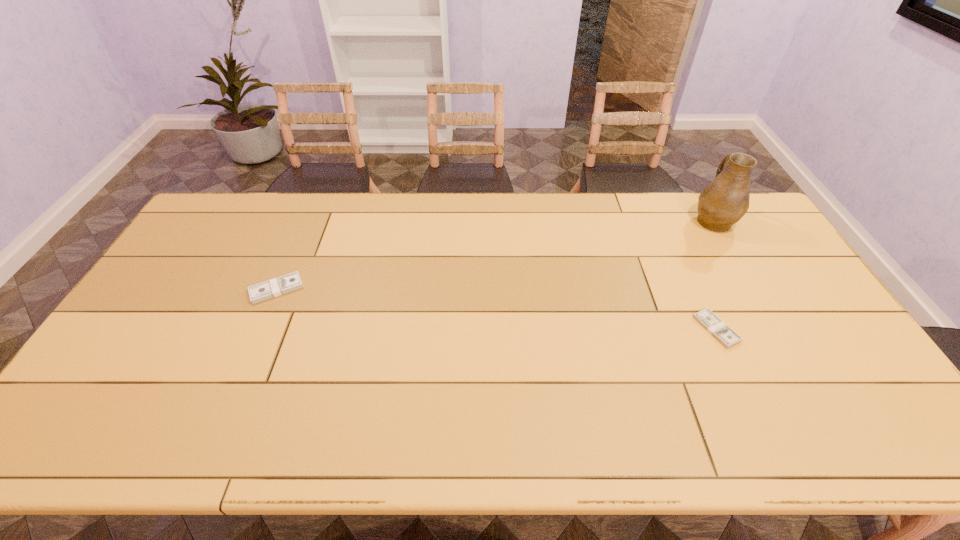
Where is `free space between the nearer dollar and the rightmost object`? The height and width of the screenshot is (540, 960). free space between the nearer dollar and the rightmost object is located at coordinates (714, 275).

I want to click on empty space that is in between the second object from right to left and the farther dollar, so click(496, 309).

Where is `vacant space in between the farthest object and the nearer dollar`? vacant space in between the farthest object and the nearer dollar is located at coordinates (714, 275).

I want to click on empty location between the second object from right to left and the farthest object, so click(x=714, y=275).

The image size is (960, 540). I want to click on free space between the tallest object and the second object from right to left, so click(714, 275).

Point out which object is positioned as the nearest to the leftmost object. Please provide its 2D coordinates. Your answer should be formatted as a tuple, i.e. [(x, y)], where the tuple contains the x and y coordinates of a point satisfying the conditions above.

[(716, 327)]

Locate an element on the screen. Image resolution: width=960 pixels, height=540 pixels. object that stands as the second closest to the pitcher is located at coordinates (281, 285).